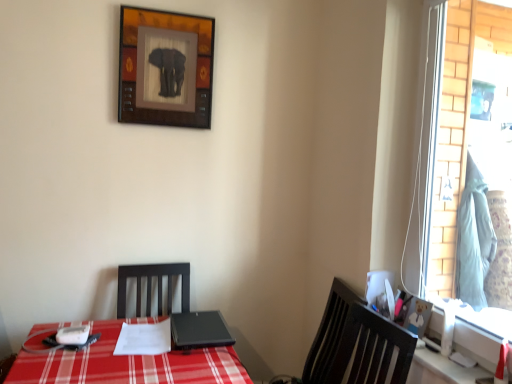
The height and width of the screenshot is (384, 512). What are the coordinates of `free point in front of wooden bear picture frame at right, which appears as the 2th picture frame when viewed from the top` in the screenshot? It's located at (440, 355).